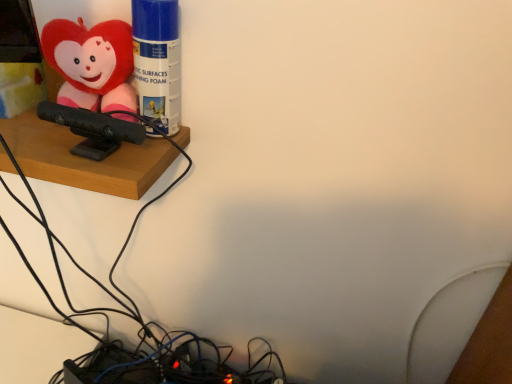
Where is `velvet plush heart at upper left`? The width and height of the screenshot is (512, 384). velvet plush heart at upper left is located at coordinates pos(92,63).

Measure the distance between velvet plush heart at upper left and camera.

They are 24.55 inches apart.

What do you see at coordinates (92, 63) in the screenshot? I see `velvet plush heart at upper left` at bounding box center [92, 63].

The height and width of the screenshot is (384, 512). I want to click on velvet plush heart at upper left, so click(x=92, y=63).